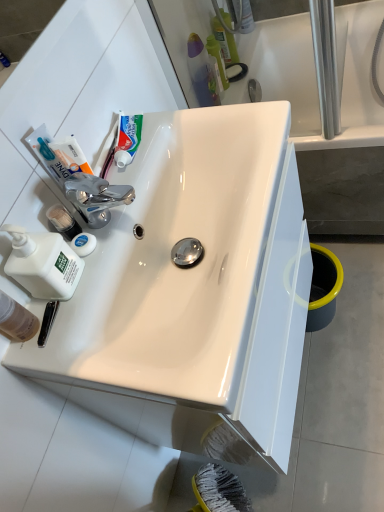
Identify the location of free space in front of green matte toothpaste at upper center. The height and width of the screenshot is (512, 384). (131, 189).